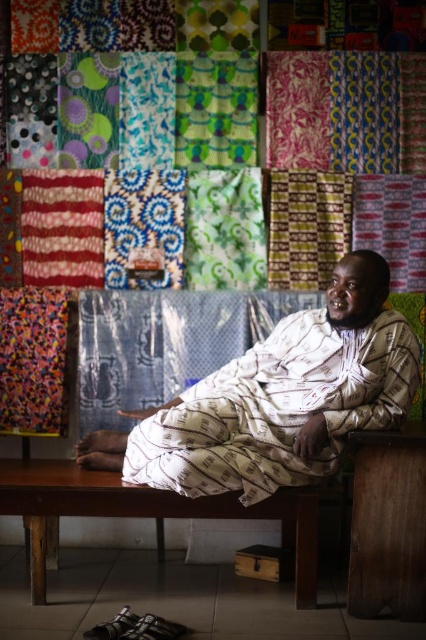
Locate an element on the screen. The image size is (426, 640). matte blue fabric at center is located at coordinates (362, 120).

Is point (313, 113) closer to camera compared to point (91, 477)?

No, (313, 113) is further to viewer.

The height and width of the screenshot is (640, 426). Describe the element at coordinates (362, 120) in the screenshot. I see `matte blue fabric at center` at that location.

At what (x,y) coordinates should I click in order to perform the action: click on matte blue fabric at center. Please return your answer as a coordinate pair (x, y). The width and height of the screenshot is (426, 640). Looking at the image, I should click on (362, 120).

Identify the location of white printed fabric at center. The height and width of the screenshot is (640, 426). (278, 400).

Is white printed fabric at center further to camera compared to matte blue fabric at center?

No, it is in front of matte blue fabric at center.

In order to click on white printed fabric at center in this screenshot , I will do `click(278, 400)`.

Which is below, white printed fabric at center or brown wooden bench at lower center?

brown wooden bench at lower center is below.

What do you see at coordinates (278, 400) in the screenshot? I see `white printed fabric at center` at bounding box center [278, 400].

At what (x,y) coordinates should I click in order to perform the action: click on white printed fabric at center. Please return your answer as a coordinate pair (x, y). This screenshot has width=426, height=640. Looking at the image, I should click on (278, 400).